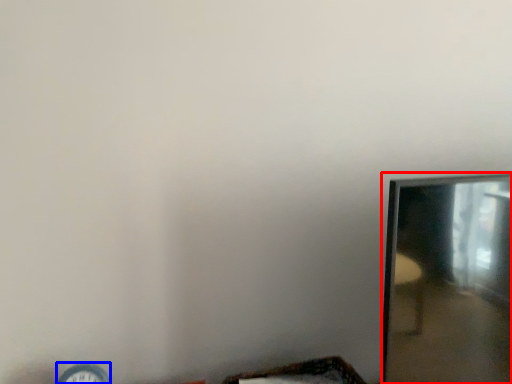
Question: Which object appears farthest to the camera in this image, mirror (highlighted by a red box) or clock (highlighted by a blue box)?

Choices:
 (A) mirror
 (B) clock

Answer: (B)